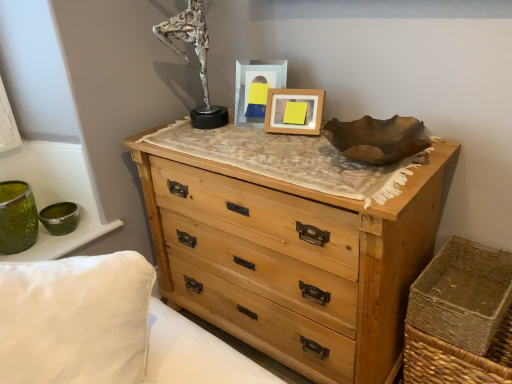
This screenshot has height=384, width=512. I want to click on vacant region to the left of matte plastic picture frame at center, which is counted as the 1th picture frame, starting from the left, so click(218, 121).